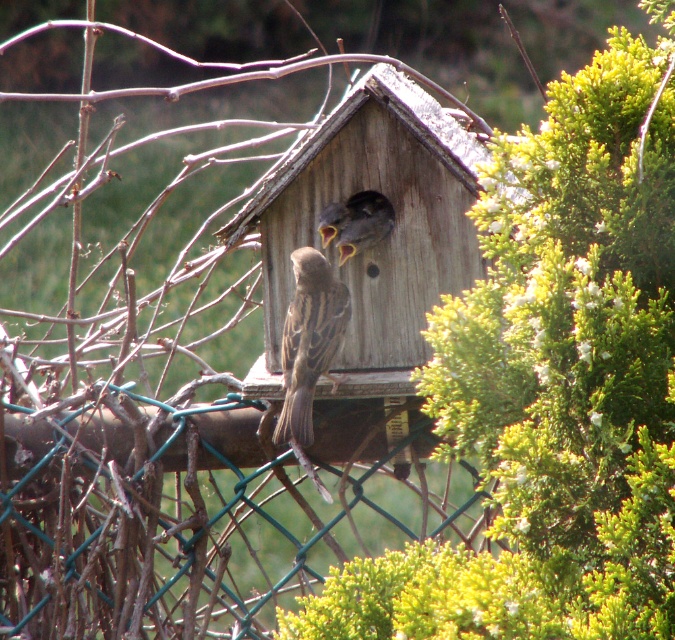
Can you confirm if green leafy bush at upper right is thinner than green wire mesh at center?

Yes.

Based on the photo, does green leafy bush at upper right appear over green wire mesh at center?

Correct, green leafy bush at upper right is located above green wire mesh at center.

At what (x,y) coordinates should I click in order to perform the action: click on green leafy bush at upper right. Please return your answer as a coordinate pair (x, y). This screenshot has width=675, height=640. Looking at the image, I should click on (551, 381).

Locate an element on the screen. This screenshot has height=640, width=675. green leafy bush at upper right is located at coordinates (551, 381).

Looking at this image, can you confirm if brown matte sparrow at center is smaller than brown matte bird at center?

Incorrect, brown matte sparrow at center is not smaller in size than brown matte bird at center.

This screenshot has height=640, width=675. Describe the element at coordinates (308, 340) in the screenshot. I see `brown matte sparrow at center` at that location.

Which is in front, point (286, 417) or point (367, 214)?

Point (286, 417)

What are the coordinates of `brown matte sparrow at center` in the screenshot? It's located at (308, 340).

From the picture: Does green leafy bush at upper right appear over brown matte bird at center?

No, green leafy bush at upper right is not above brown matte bird at center.

This screenshot has width=675, height=640. What are the coordinates of `green leafy bush at upper right` in the screenshot? It's located at (551, 381).